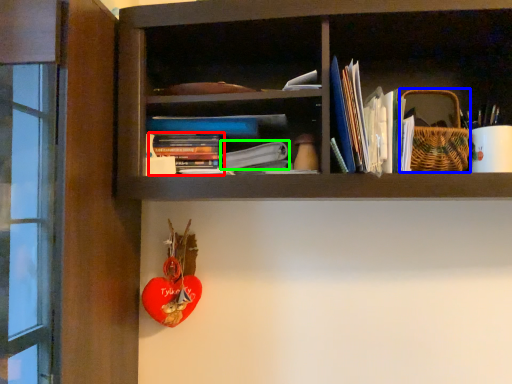
Question: Based on their relative distances, which object is farther from book (highlighted by a red box)? Choose from basket (highlighted by a blue box) and paperback book (highlighted by a green box).

Choices:
 (A) basket
 (B) paperback book

Answer: (A)